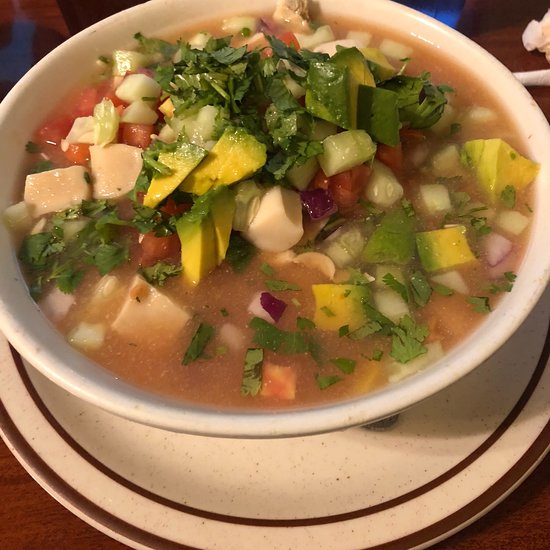
Locate an element on the screen. plate is located at coordinates (484, 437).